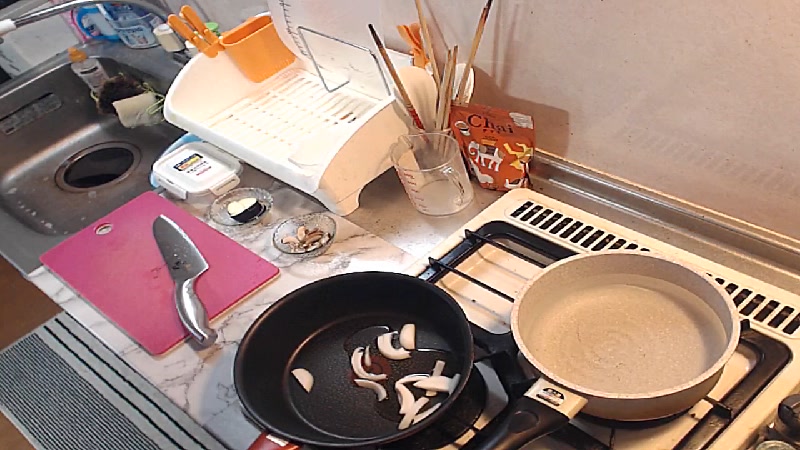
I want to click on rug, so click(x=57, y=374).